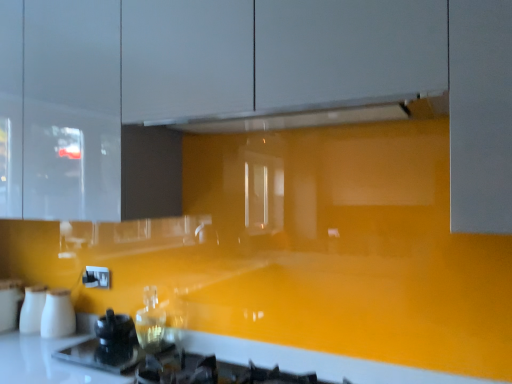
Question: Is white matte milk jugs at lower left, placed as the third appliance when sorted from left to right, in contact with white glossy exhaust hood at upper center?

Choices:
 (A) no
 (B) yes

Answer: (A)

Question: Can you confirm if white matte milk jugs at lower left, placed as the second appliance when sorted from right to left, is thinner than white glossy exhaust hood at upper center?

Choices:
 (A) yes
 (B) no

Answer: (A)

Question: From a real-world perspective, does white matte milk jugs at lower left, placed as the second appliance when sorted from right to left, stand above white glossy exhaust hood at upper center?

Choices:
 (A) no
 (B) yes

Answer: (A)

Question: From a real-world perspective, is white matte milk jugs at lower left, placed as the second appliance when sorted from right to left, located beneath white glossy exhaust hood at upper center?

Choices:
 (A) no
 (B) yes

Answer: (B)

Question: Is white matte milk jugs at lower left, placed as the second appliance when sorted from right to left, positioned far away from white glossy exhaust hood at upper center?

Choices:
 (A) no
 (B) yes

Answer: (B)

Question: Does white matte milk jugs at lower left, placed as the third appliance when sorted from left to right, have a larger size compared to white glossy exhaust hood at upper center?

Choices:
 (A) yes
 (B) no

Answer: (B)

Question: Does black glossy kettle at lower left, which is the first appliance in right-to-left order, have a lesser height compared to white glossy salt and pepper shakers at lower left, which appears as the 2th appliance when viewed from the left?

Choices:
 (A) no
 (B) yes

Answer: (B)

Question: Are black glossy kettle at lower left, positioned as the fourth appliance in left-to-right order, and white glossy salt and pepper shakers at lower left, which appears as the 2th appliance when viewed from the left, making contact?

Choices:
 (A) no
 (B) yes

Answer: (A)

Question: Is black glossy kettle at lower left, positioned as the fourth appliance in left-to-right order, wider than white glossy salt and pepper shakers at lower left, which appears as the 2th appliance when viewed from the left?

Choices:
 (A) yes
 (B) no

Answer: (B)

Question: Can you confirm if black glossy kettle at lower left, which is the first appliance in right-to-left order, is taller than white glossy salt and pepper shakers at lower left, the third appliance viewed from the right?

Choices:
 (A) yes
 (B) no

Answer: (B)

Question: Does black glossy kettle at lower left, positioned as the fourth appliance in left-to-right order, have a larger size compared to white glossy salt and pepper shakers at lower left, which appears as the 2th appliance when viewed from the left?

Choices:
 (A) no
 (B) yes

Answer: (A)

Question: From a real-world perspective, is black glossy kettle at lower left, which is the first appliance in right-to-left order, under white glossy salt and pepper shakers at lower left, which appears as the 2th appliance when viewed from the left?

Choices:
 (A) no
 (B) yes

Answer: (B)

Question: Considering the relative sizes of black glossy kettle at lower left, positioned as the fourth appliance in left-to-right order, and white glossy exhaust hood at upper center in the image provided, is black glossy kettle at lower left, positioned as the fourth appliance in left-to-right order, shorter than white glossy exhaust hood at upper center?

Choices:
 (A) yes
 (B) no

Answer: (B)